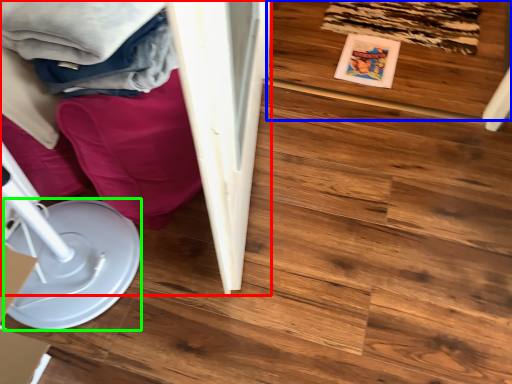
Question: Which object is the farthest from furniture (highlighted by a red box)? Choose among these: wood (highlighted by a blue box) or paper plate (highlighted by a green box).

Choices:
 (A) wood
 (B) paper plate

Answer: (A)